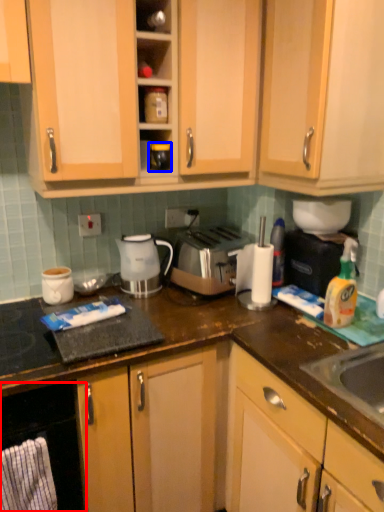
Question: Which object appears closest to the camera in this image, oven (highlighted by a red box) or appliance (highlighted by a blue box)?

Choices:
 (A) oven
 (B) appliance

Answer: (A)